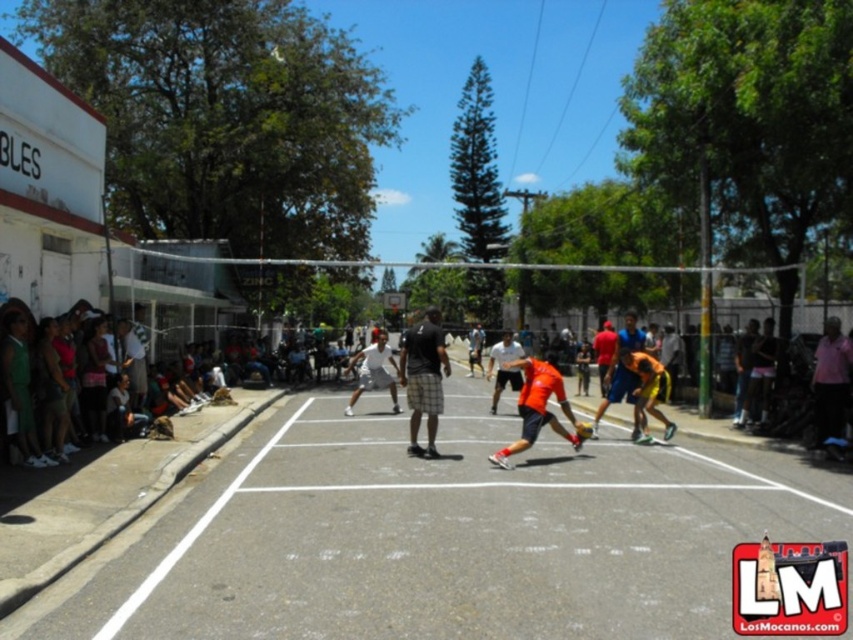
You are a photographer trying to capture a closeup of the black cotton shirt at center and white matte shorts at center. Since you want to focus on the shirt, should you adjust your camera to have a wider or narrower depth of field?

To focus on the black cotton shirt at center while keeping the white matte shorts at center out of focus, you should use a narrower depth of field. This will blur the background and shorts, making the shirt the main focus.

You are a photographer trying to capture the volleyball game. You notice the white asphalt court at center and the white matte shorts at center. Which object is closer to the camera lens?

The white matte shorts at center are closer to the camera lens because the white asphalt court at center is positioned under it.

You are a photographer trying to capture a closeup shot of the black cotton shirt at center and white matte shorts at center. Which one would you need to zoom in more on to make them appear the same size in the photo?

The black cotton shirt at center has a smaller size compared to white matte shorts at center, so you would need to zoom in more on the black cotton shirt at center to make them appear the same size in the photo.